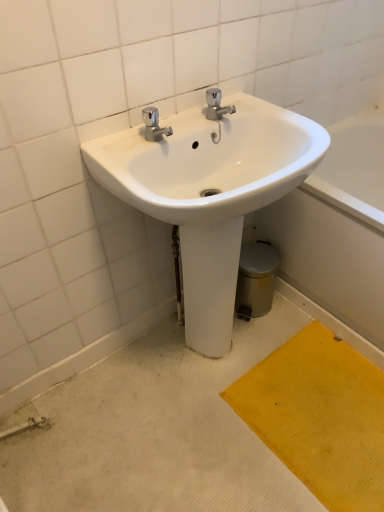
At what (x,y) coordinates should I click in order to perform the action: click on free space between white glossy sink at center and yellow textured mat at lower right. Please return your answer as a coordinate pair (x, y). This screenshot has width=384, height=512. Looking at the image, I should click on (244, 457).